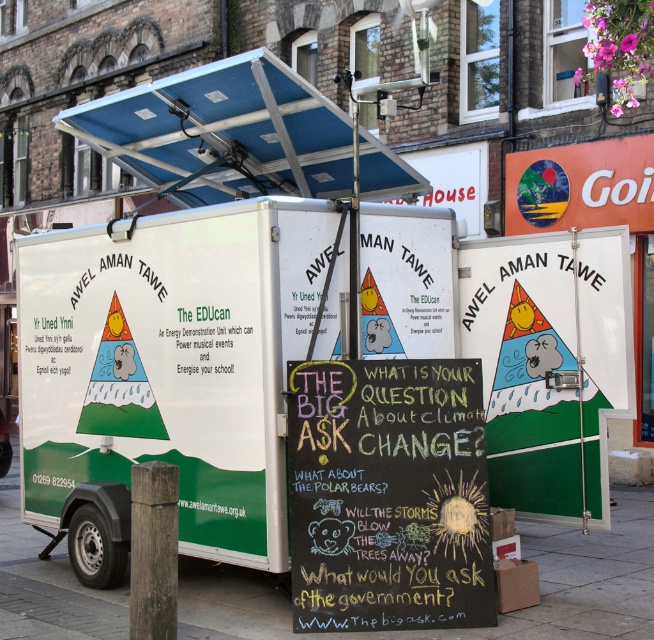
Consider the image. You are standing in front of the EDUcan mobile educational unit parked on a paved street. You need to place a small sign on the green concrete pavement at lower center. According to the coordinates provided, where exactly should you place the sign?

The green concrete pavement at lower center is located at point (496, 614), so you should place the sign there.

You are standing in front of the EDUcan and want to place a small potted plant on the green concrete pavement at lower center. If the pavement is represented by coordinates, where exactly should you place the plant?

The green concrete pavement at lower center is located at coordinates point [496,614], so place the plant there.

You are a photographer planning to take a wide shot of the EDUcan from the street. Considering the green concrete pavement at lower center and the blue metallic canopy at upper center, which object will appear larger in your photo?

The blue metallic canopy at upper center will appear larger in the photo since it occupies more space than the green concrete pavement at lower center.